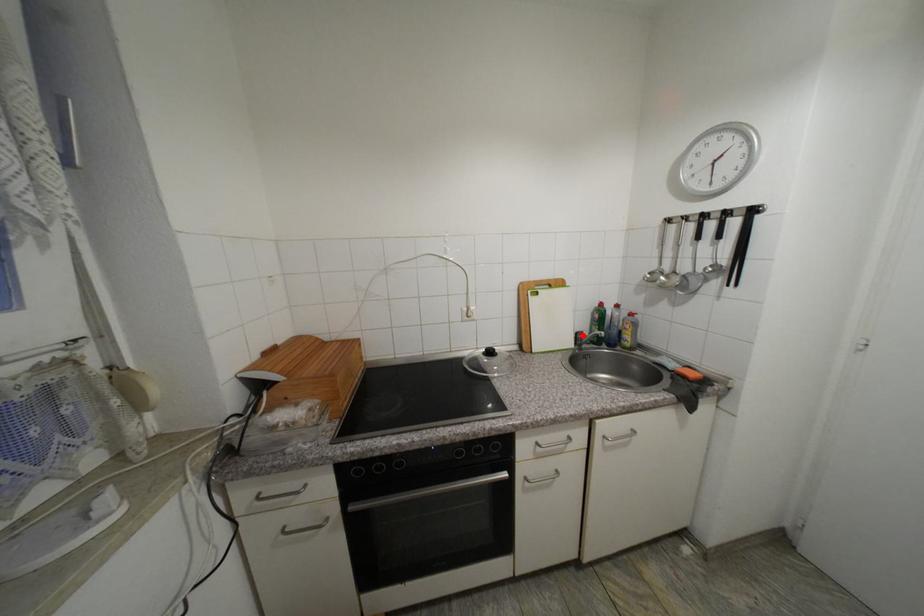
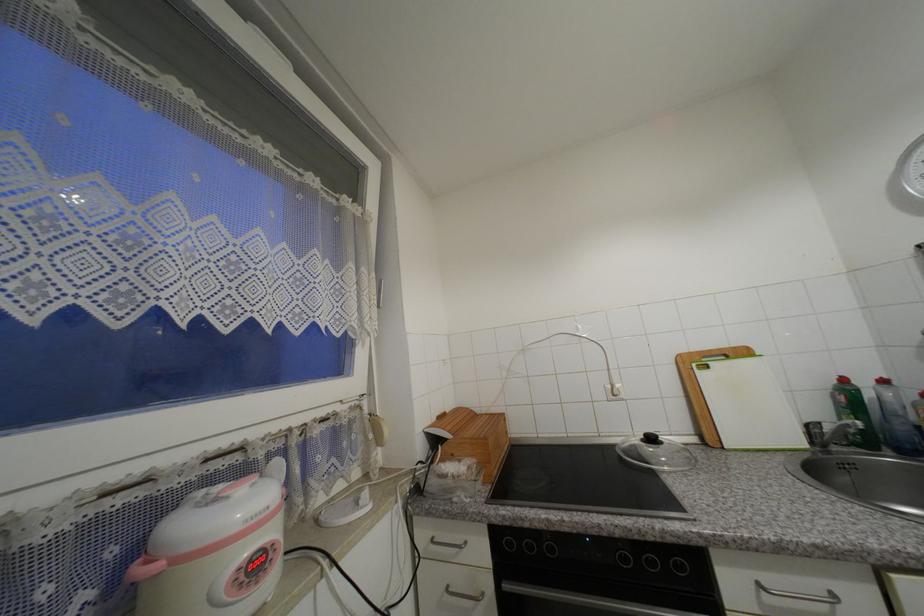
Question: I am providing you with two images of the same scene from different viewpoints. Image1 has a red point marked. In image2, the corresponding 3D location appears at what relative position? Reply with the corresponding letter.

Choices:
 (A) Closer
 (B) Farther

Answer: (A)